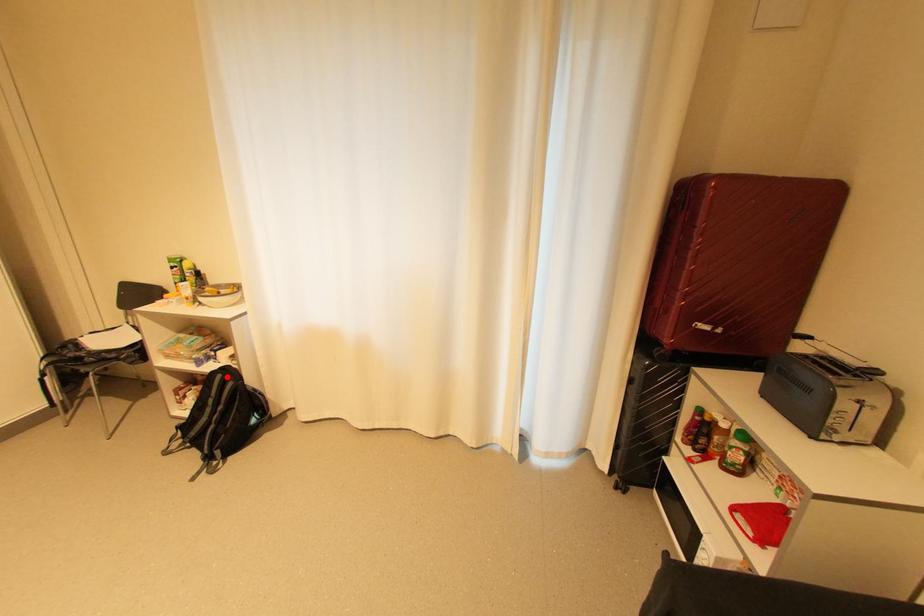
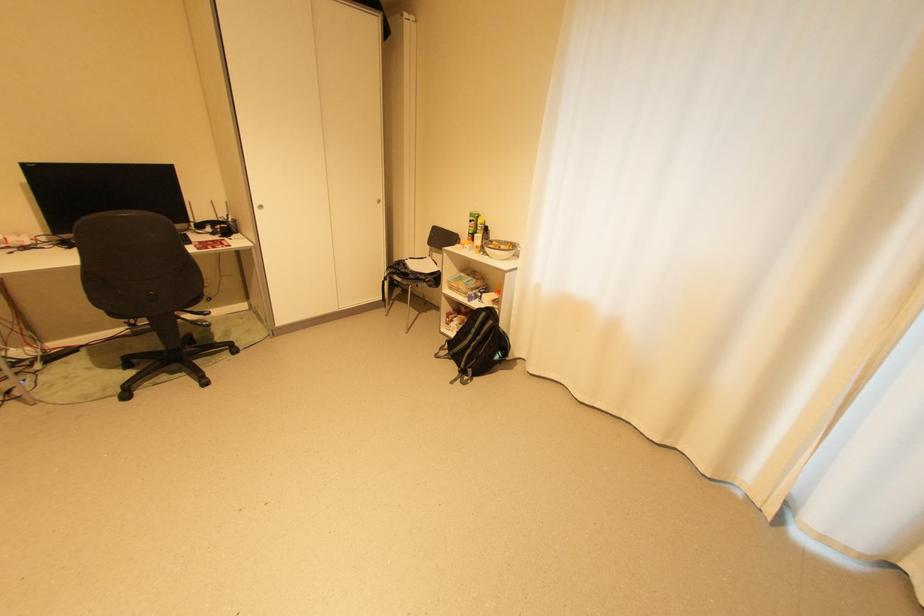
Where in the second image is the point corresponding to the highlighted location from the first image?

(492, 314)